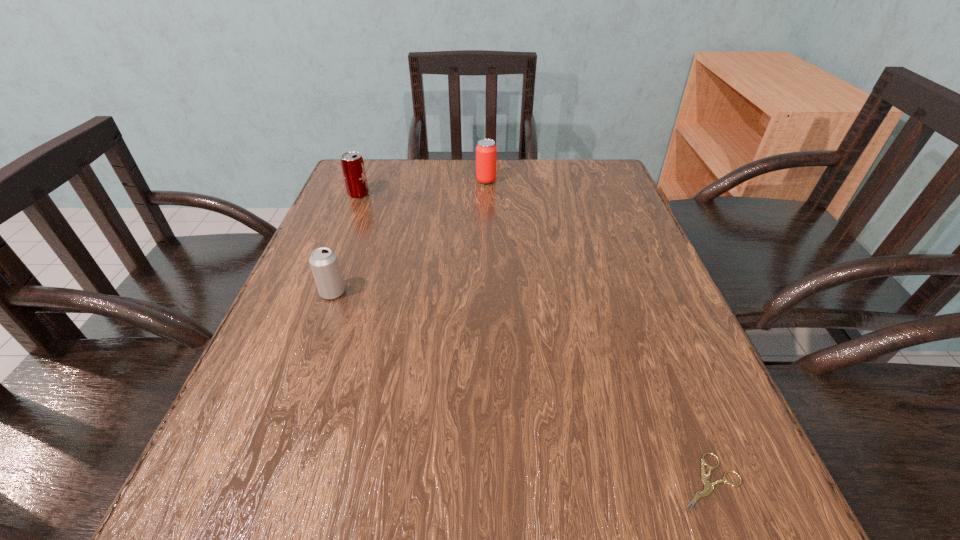
Find the location of a particular element. Image resolution: width=960 pixels, height=540 pixels. empty space that is in between the second nearest object and the third object from left to right is located at coordinates (409, 237).

Where is `free area in between the second nearest object and the farthest object`? This screenshot has width=960, height=540. free area in between the second nearest object and the farthest object is located at coordinates (409, 237).

Locate an element on the screen. The width and height of the screenshot is (960, 540). free space between the nearest object and the third nearest object is located at coordinates (533, 339).

Identify the location of free space between the second farthest beer can and the nearest beer can. (346, 244).

Locate an element on the screen. This screenshot has width=960, height=540. vacant region between the rightmost beer can and the nearest object is located at coordinates point(597,332).

Find the location of a particular element. free space between the second nearest object and the nearest object is located at coordinates (520, 388).

Identify the location of free space between the rightmost object and the farthest object. (597, 332).

Find the location of a particular element. Image resolution: width=960 pixels, height=540 pixels. free space between the second farthest object and the farthest beer can is located at coordinates (422, 187).

Locate an element on the screen. This screenshot has height=540, width=960. free space between the rightmost object and the second nearest object is located at coordinates (520, 388).

At what (x,y) coordinates should I click in order to perform the action: click on free space between the shears and the second farthest beer can. Please return your answer as a coordinate pair (x, y). This screenshot has width=960, height=540. Looking at the image, I should click on (533, 339).